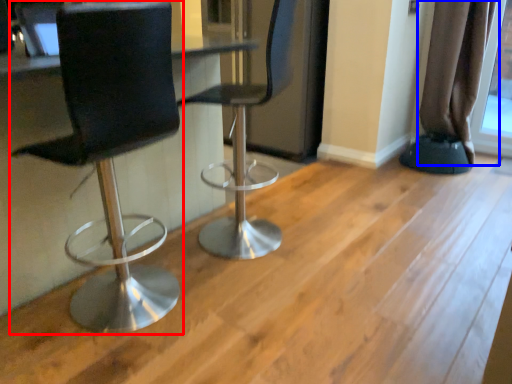
Question: Which point is further to the camera, chair (highlighted by a red box) or curtain (highlighted by a blue box)?

Choices:
 (A) chair
 (B) curtain

Answer: (B)